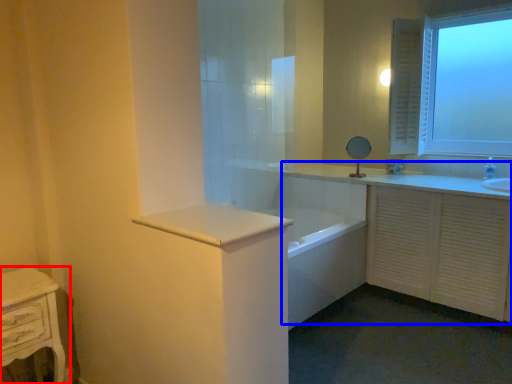
Question: Which point is closer to the camera, nightstand (highlighted by a red box) or bathroom cabinet (highlighted by a blue box)?

Choices:
 (A) nightstand
 (B) bathroom cabinet

Answer: (A)